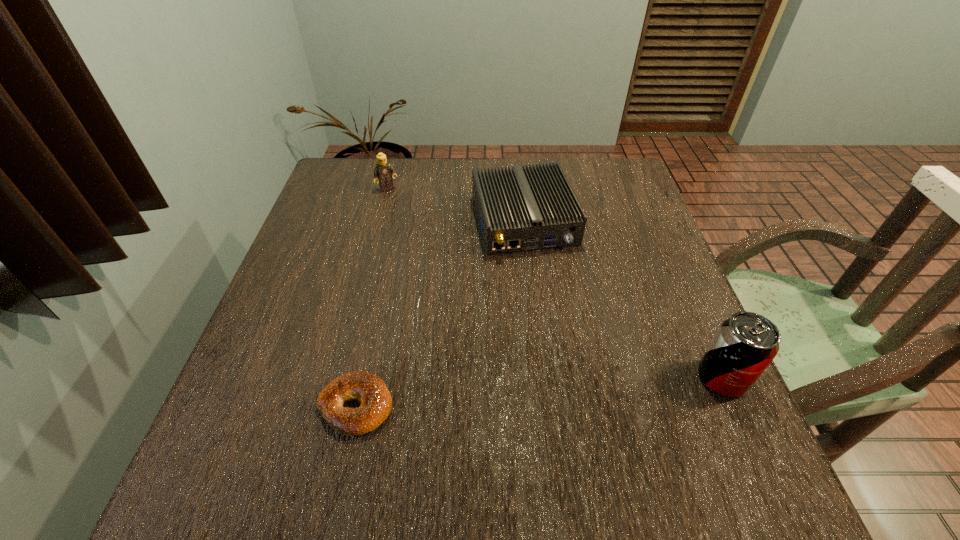
I want to click on bagel, so click(367, 388).

Locate an element on the screen. the tallest object is located at coordinates (746, 343).

The width and height of the screenshot is (960, 540). I want to click on soda can, so click(x=746, y=343).

This screenshot has height=540, width=960. What are the coordinates of `the third tallest object` in the screenshot? It's located at (535, 208).

This screenshot has width=960, height=540. What are the coordinates of `the second object from right to left` in the screenshot? It's located at (535, 208).

Locate an element on the screen. Lego is located at coordinates (384, 172).

Where is `free space located on the right of the bagel`? The width and height of the screenshot is (960, 540). free space located on the right of the bagel is located at coordinates (549, 407).

Image resolution: width=960 pixels, height=540 pixels. I want to click on vacant space located on the back of the rightmost object, so click(703, 333).

Locate an element on the screen. This screenshot has height=540, width=960. free space located on the back panel of the router is located at coordinates (564, 339).

Where is `vacant point located 0.080m on the back panel of the router`? This screenshot has width=960, height=540. vacant point located 0.080m on the back panel of the router is located at coordinates (545, 283).